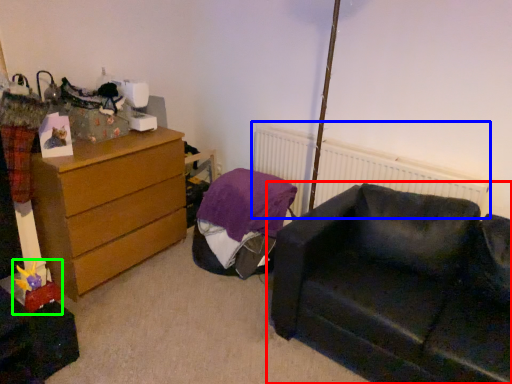
Question: Which is nearer to the studio couch (highlighted by a red box)? radiator (highlighted by a blue box) or toy (highlighted by a green box).

Choices:
 (A) radiator
 (B) toy

Answer: (A)